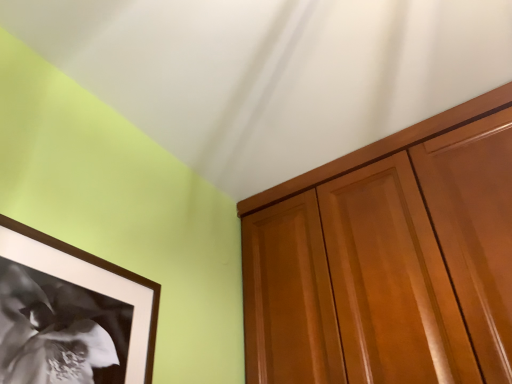
Question: Considering the positions of glossy wood cabinet at upper right and black matte picture frame at lower left in the image, is glossy wood cabinet at upper right taller or shorter than black matte picture frame at lower left?

Choices:
 (A) tall
 (B) short

Answer: (A)

Question: Is glossy wood cabinet at upper right situated inside black matte picture frame at lower left or outside?

Choices:
 (A) outside
 (B) inside

Answer: (A)

Question: From a real-world perspective, is glossy wood cabinet at upper right physically located above or below black matte picture frame at lower left?

Choices:
 (A) above
 (B) below

Answer: (A)

Question: In terms of size, does black matte picture frame at lower left appear bigger or smaller than glossy wood cabinet at upper right?

Choices:
 (A) big
 (B) small

Answer: (B)

Question: Is black matte picture frame at lower left wider or thinner than glossy wood cabinet at upper right?

Choices:
 (A) thin
 (B) wide

Answer: (A)

Question: Is black matte picture frame at lower left taller or shorter than glossy wood cabinet at upper right?

Choices:
 (A) short
 (B) tall

Answer: (A)

Question: Would you say black matte picture frame at lower left is to the left or to the right of glossy wood cabinet at upper right in the picture?

Choices:
 (A) left
 (B) right

Answer: (A)